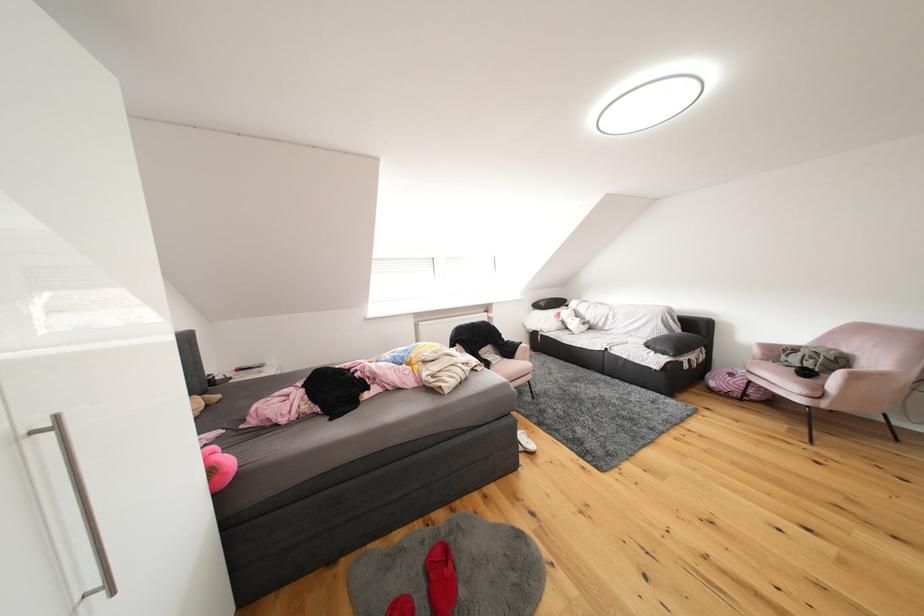
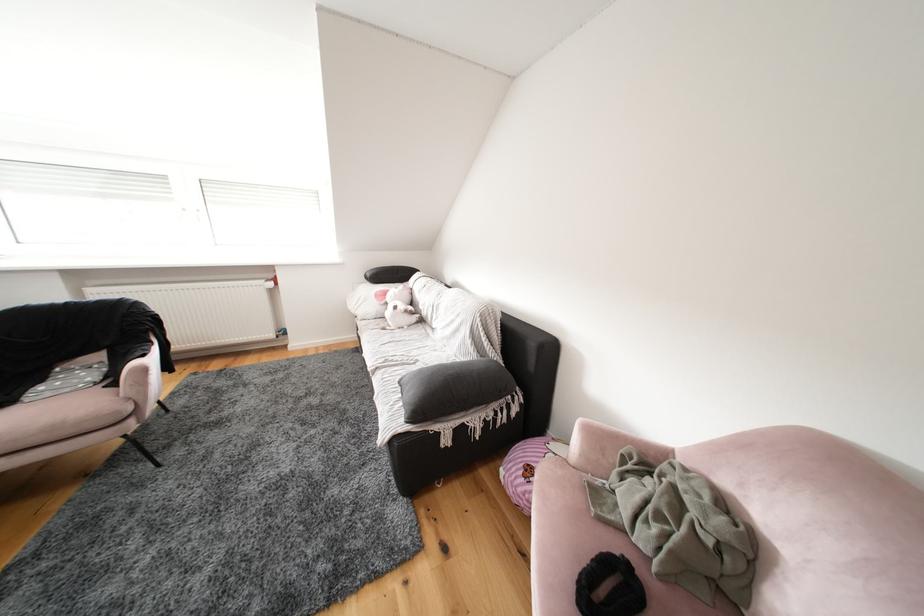
The images are taken continuously from a first-person perspective. In which direction are you moving?

The movement direction of the cameraman is right, forward.